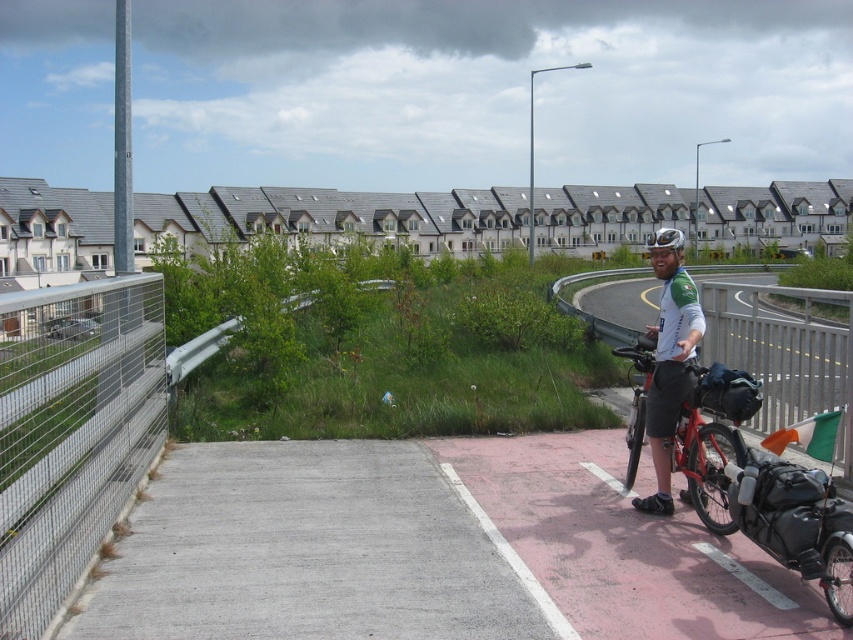
You are a drone operator trying to capture a photo of the cyclist and their bicycle. You need to position your drone between the two points marked as point [380,378] and point [735,420]. Which point should the drone be closer to in order to ensure it stays within the paved path and avoids the metal railings?

Answer: The drone should be closer to point [380,378] because it is closer to the viewer and thus more likely to stay within the paved path while avoiding the metal railings on both sides.

Looking at this image, you are a delivery person with a heavy package that requires a 20 feet distance to safely place it. You see the gray concrete bike lane at center and the concrete at center in the scene. Is there enough space between them to place your package?

The gray concrete bike lane at center is 19.21 feet from concrete at center, which is less than the required 20 feet. Therefore, there isn not enough space to safely place the package between them.

You are a cyclist planning to ride your matte red bicycle at right along the gray concrete bike lane at center. Since the bike lane is on the left side of your bicycle, which direction should you turn to enter the bike lane?

Since the gray concrete bike lane at center is positioned on the left side of matte red bicycle at right, you should turn left to enter the bike lane.